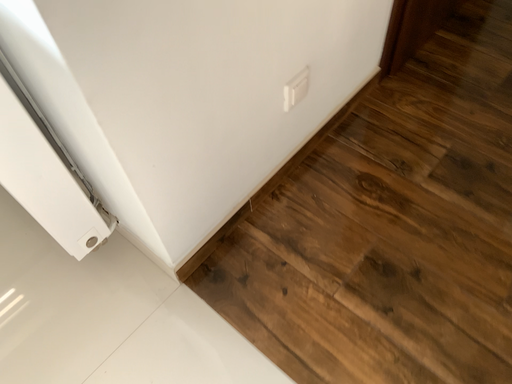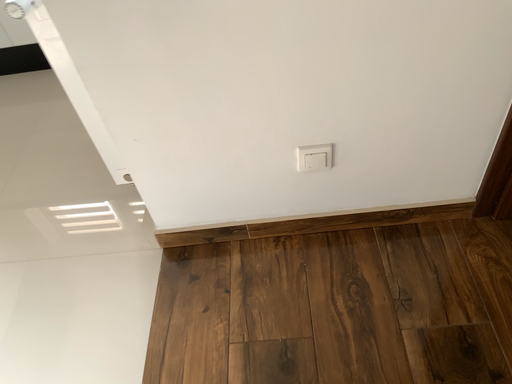
Question: How did the camera likely rotate when shooting the video?

Choices:
 (A) rotated left
 (B) rotated right

Answer: (A)